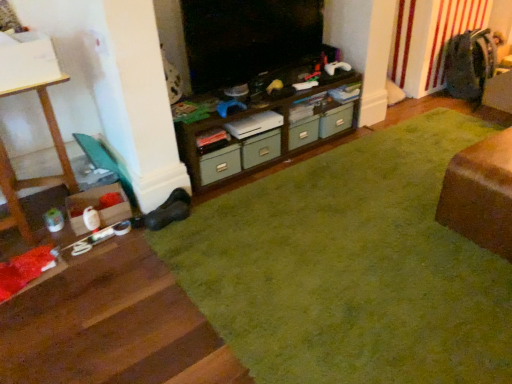
You are a GUI agent. You are given a task and a screenshot of the screen. Output one action in this format:
    pyautogui.click(x=<x>, y=<y>)
    Task: Click on the free spot above green carpet at center (from a real-world perspective)
    
    Given the screenshot: What is the action you would take?
    pyautogui.click(x=366, y=246)